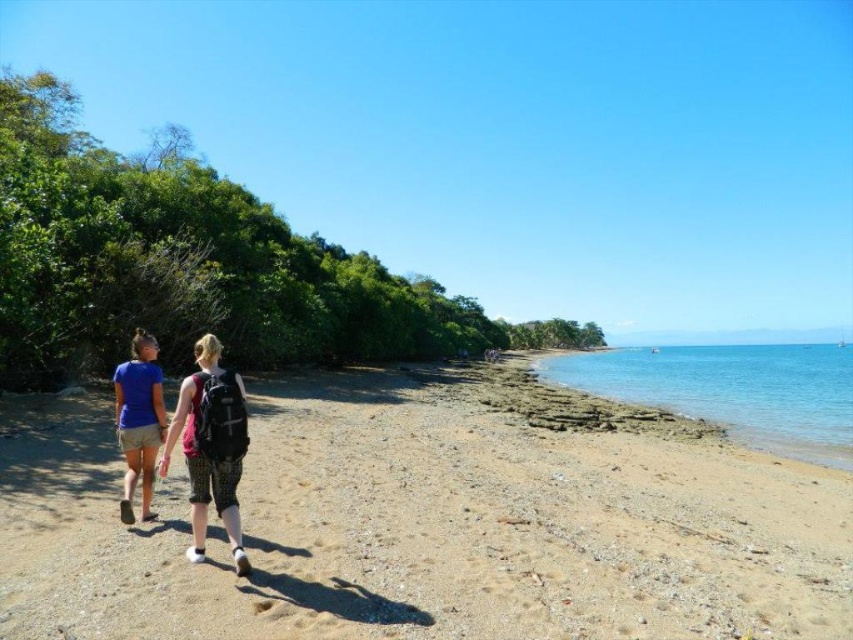
You are standing on the beach and want to place your sunglasses on the clear blue water at right without them getting wet. Can you do this by placing them on the matte black backpack at lower left?

The clear blue water at right is below the matte black backpack at lower left, so placing sunglasses on the backpack would keep them above the water and dry.

You are standing at the beach looking towards the ocean. There are two points marked on the sand. The first point is at coordinate point (827, 460) and the second is at coordinate point (123, 371). Which point is closer to you?

Point (123, 371) is closer to you because it is nearer to the camera compared to point (827, 460).